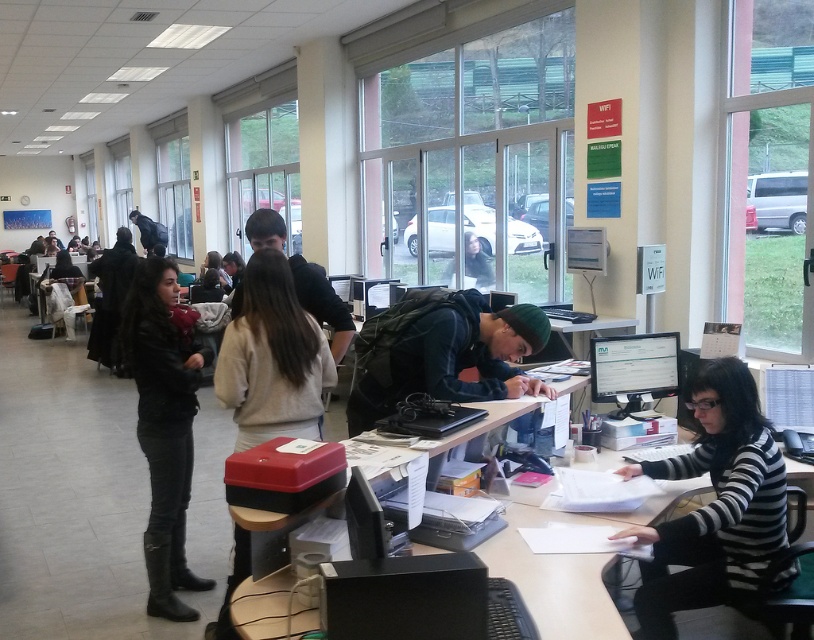
You are standing at point (475,236) and want to walk to the exit located at point (677,346). Is the exit directly in front of you or behind you?

The exit at point (677,346) is in front of you because it is located in front of point (475,236) where you are standing.